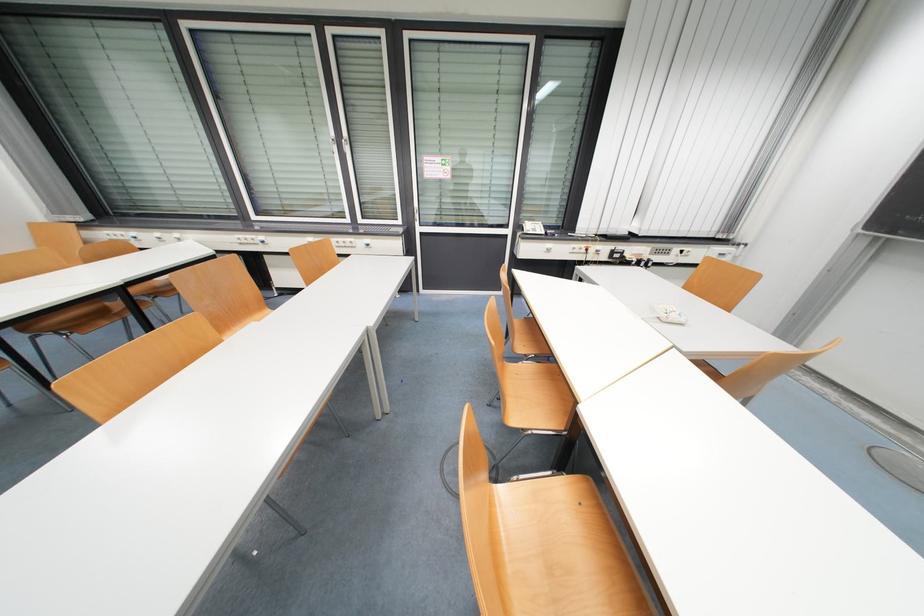
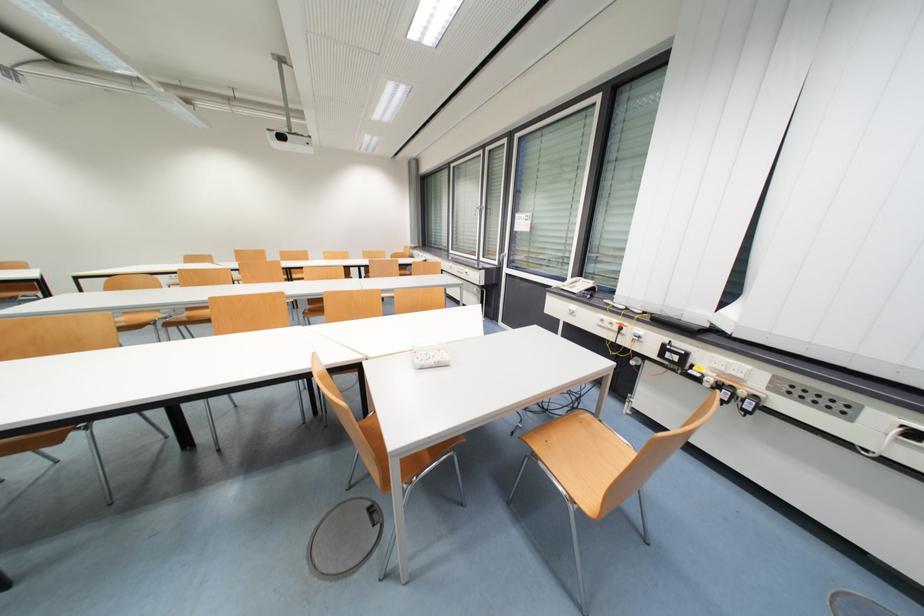
The point at [589,246] is marked in the first image. Where is the corresponding point in the second image?

(622, 323)